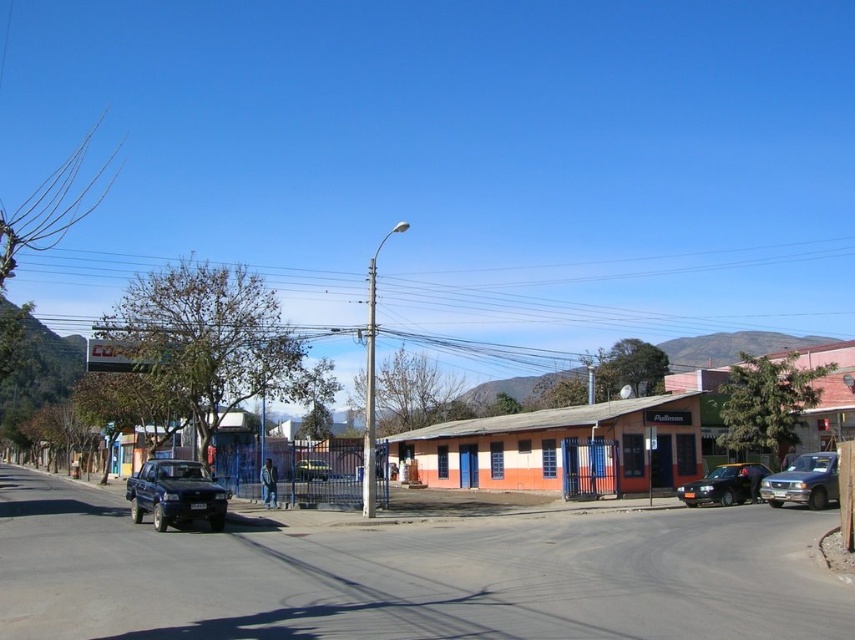
Is point (211, 500) positioned in front of point (832, 474)?

Yes, point (211, 500) is closer to viewer.

Locate an element on the screen. matte black truck at lower left is located at coordinates (175, 493).

Identify the location of matte black truck at lower left. (175, 493).

Who is more forward, (175, 497) or (296, 477)?

Point (175, 497) is more forward.

Is matte black truck at lower left wider than metallic blue truck at center?

Yes.

At what (x,y) coordinates should I click in order to perform the action: click on matte black truck at lower left. Please return your answer as a coordinate pair (x, y). Image resolution: width=855 pixels, height=640 pixels. Looking at the image, I should click on (175, 493).

Does matte black truck at lower left have a smaller size compared to shiny black sedan at center?

No.

Does matte black truck at lower left appear on the left side of shiny black sedan at center?

Yes, matte black truck at lower left is to the left of shiny black sedan at center.

Locate an element on the screen. This screenshot has width=855, height=640. matte black truck at lower left is located at coordinates (175, 493).

You are a GUI agent. You are given a task and a screenshot of the screen. Output one action in this format:
    pyautogui.click(x=<x>, y=<y>)
    Task: Click on the matte black truck at lower left
    The height and width of the screenshot is (640, 855).
    Given the screenshot: What is the action you would take?
    pyautogui.click(x=175, y=493)